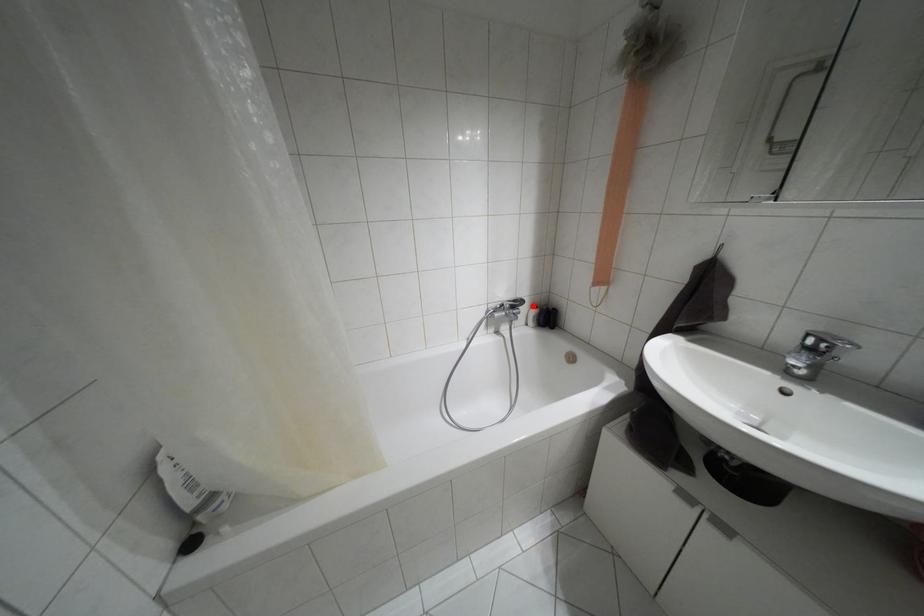
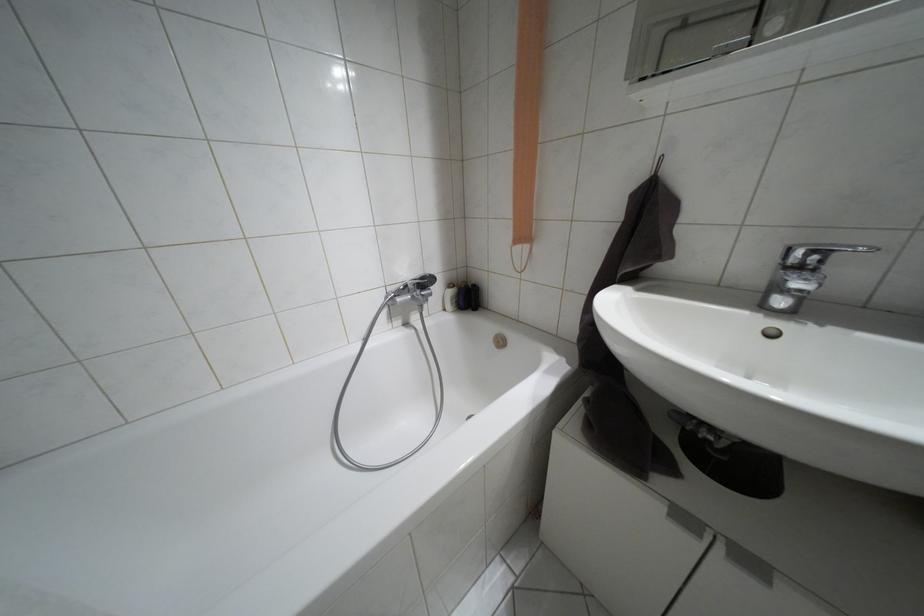
Where in the second image is the point corresponding to the highlighted location from the first image?

(448, 285)